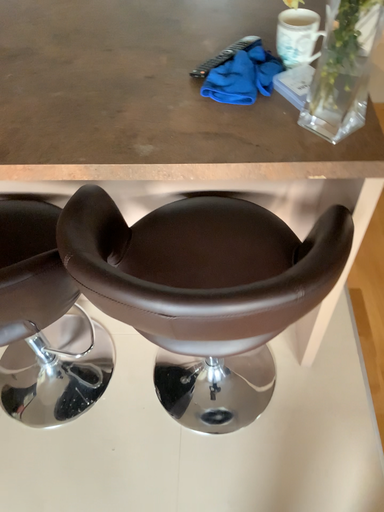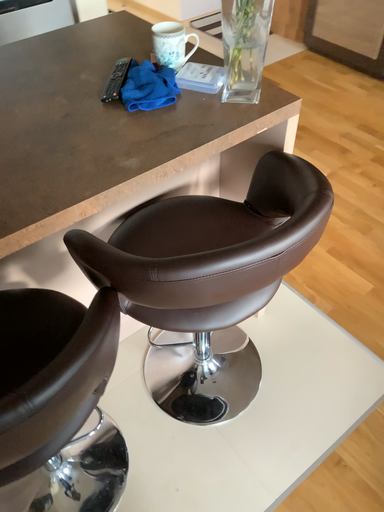
Question: How did the camera likely rotate when shooting the video?

Choices:
 (A) rotated right
 (B) rotated left

Answer: (A)